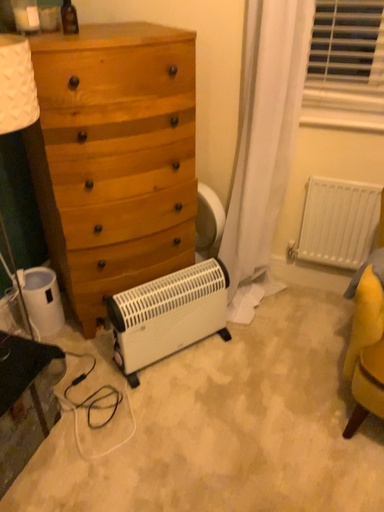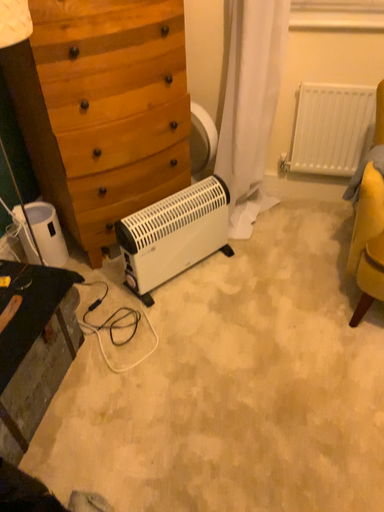
Question: How did the camera likely rotate when shooting the video?

Choices:
 (A) rotated upward
 (B) rotated downward

Answer: (B)